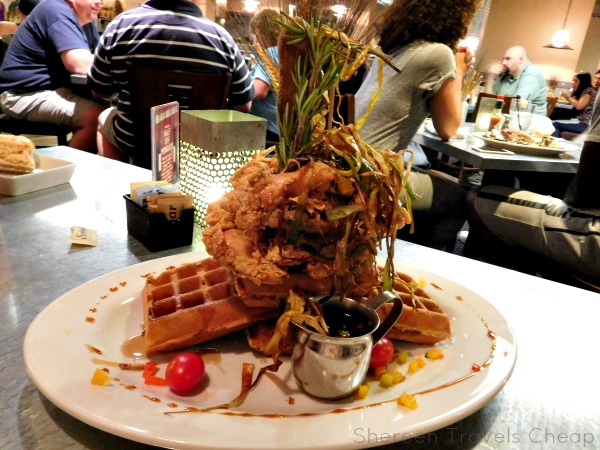
The width and height of the screenshot is (600, 450). In order to click on table in this screenshot , I will do `click(34, 275)`, `click(485, 156)`.